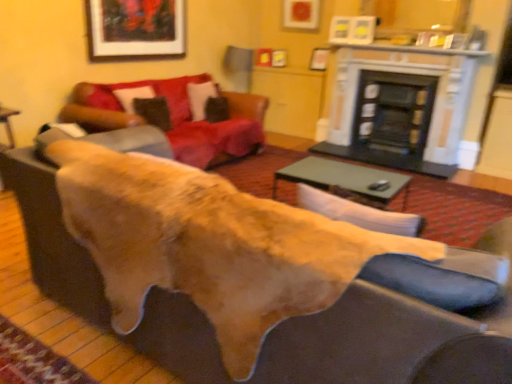
Question: From a real-world perspective, relative to wooden framed artwork at upper center, is brown suede pillow at upper left, which is the 1th pillow from front to back, vertically above or below?

Choices:
 (A) below
 (B) above

Answer: (A)

Question: Does point (142, 99) appear closer or farther from the camera than point (96, 56)?

Choices:
 (A) farther
 (B) closer

Answer: (B)

Question: Which object is positioned closest to the velvet brown pillow at center, the 1th pillow when ordered from right to left?

Choices:
 (A) leather couch at center
 (B) black marble fireplace at upper center, the 1th fireplace in the left-to-right sequence
 (C) velvet red couch at upper center
 (D) black glass fireplace at center, the 1th fireplace positioned from the right
 (E) wooden framed artwork at upper center

Answer: (C)

Question: Estimate the real-world distances between objects in this image. Which object is closer to the wooden framed artwork at upper center?

Choices:
 (A) brown suede pillow at upper left, which is the 1th pillow from front to back
 (B) wooden mantelpiece at upper center
 (C) green glass table at center
 (D) velvet brown pillow at center, acting as the 2th pillow starting from the left
 (E) velvet red couch at upper center

Answer: (E)